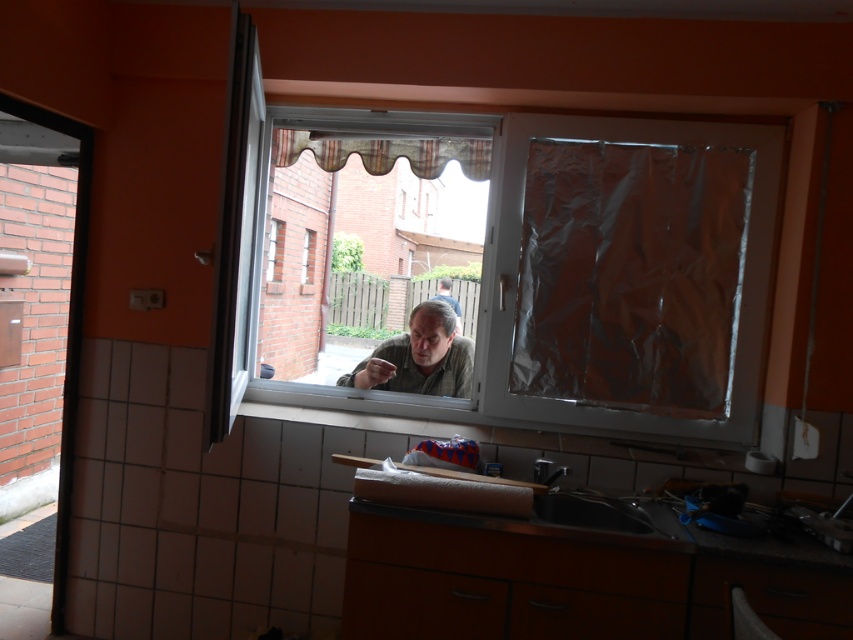
Question: Among these objects, which one is nearest to the camera?

Choices:
 (A) black matte sink at lower center
 (B) transparent plastic window at center

Answer: (A)

Question: Can you confirm if transparent plastic window at center is bigger than black matte sink at lower center?

Choices:
 (A) no
 (B) yes

Answer: (B)

Question: Is transparent plastic window at center bigger than black matte sink at lower center?

Choices:
 (A) no
 (B) yes

Answer: (B)

Question: Can you confirm if transparent plastic window at center is wider than matte brown hair at center?

Choices:
 (A) yes
 (B) no

Answer: (A)

Question: Which object is closer to the camera taking this photo?

Choices:
 (A) black matte sink at lower center
 (B) transparent plastic window at center
 (C) matte brown hair at center

Answer: (A)

Question: Which point appears farthest from the camera in this image?

Choices:
 (A) (450, 300)
 (B) (491, 116)
 (C) (578, 506)

Answer: (A)